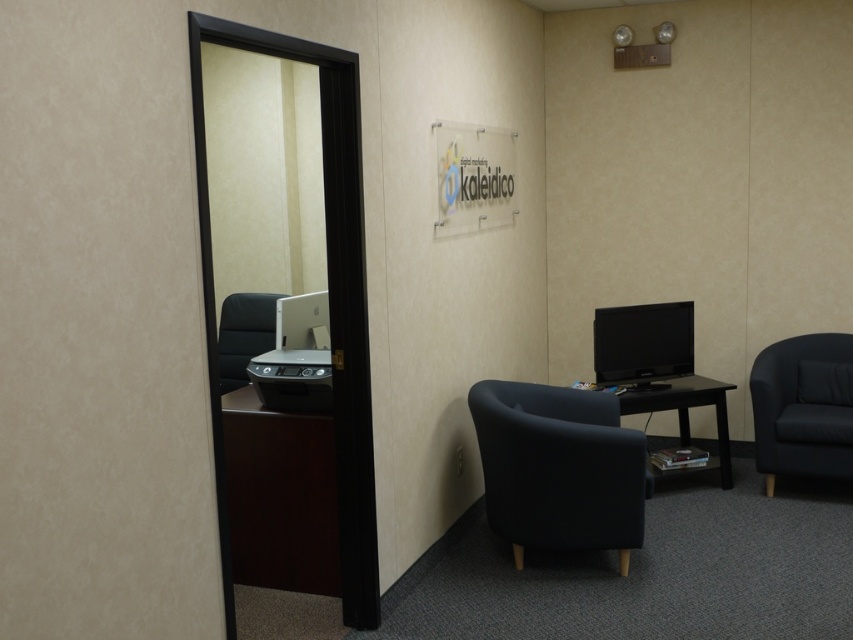
Question: Estimate the real-world distances between objects in this image. Which object is farther from the black wood table at center?

Choices:
 (A) dark blue fabric armchair at lower center
 (B) white glossy printer at center

Answer: (B)

Question: Does dark blue fabric armchair at lower center lie in front of black wood table at center?

Choices:
 (A) no
 (B) yes

Answer: (B)

Question: Estimate the real-world distances between objects in this image. Which object is farther from the black leather chair at center?

Choices:
 (A) black wood table at center
 (B) dark blue fabric armchair at lower center
 (C) black fabric swivel chair at right

Answer: (C)

Question: Does matte black monitor at right lie in front of black leather chair at center?

Choices:
 (A) no
 (B) yes

Answer: (B)

Question: Which point is farther to the camera?

Choices:
 (A) (675, 388)
 (B) (325, 310)
 (C) (224, 358)
 (D) (682, 324)

Answer: (C)

Question: Does white glossy printer at center appear over matte black monitor at right?

Choices:
 (A) yes
 (B) no

Answer: (A)